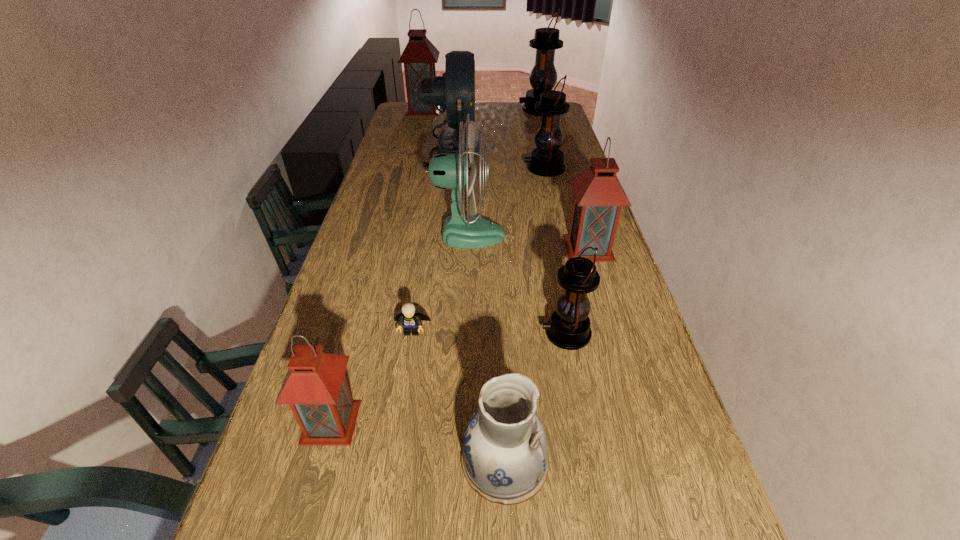
I want to click on the biggest black lantern, so click(543, 77).

I want to click on the farthest pink lantern, so click(419, 57).

This screenshot has height=540, width=960. Identify the location of the farther fan. (454, 91).

The height and width of the screenshot is (540, 960). I want to click on the nearer fan, so click(446, 170).

The width and height of the screenshot is (960, 540). In order to click on the rightmost pink lantern in this screenshot , I will do `click(599, 196)`.

Where is `the second farthest pink lantern`? the second farthest pink lantern is located at coordinates (599, 196).

The image size is (960, 540). I want to click on the second nearest black lantern, so click(x=546, y=160).

The image size is (960, 540). I want to click on the second smallest black lantern, so click(546, 160).

The image size is (960, 540). I want to click on the smallest black lantern, so click(568, 328).

This screenshot has width=960, height=540. I want to click on the fifth farthest lantern, so click(x=568, y=328).